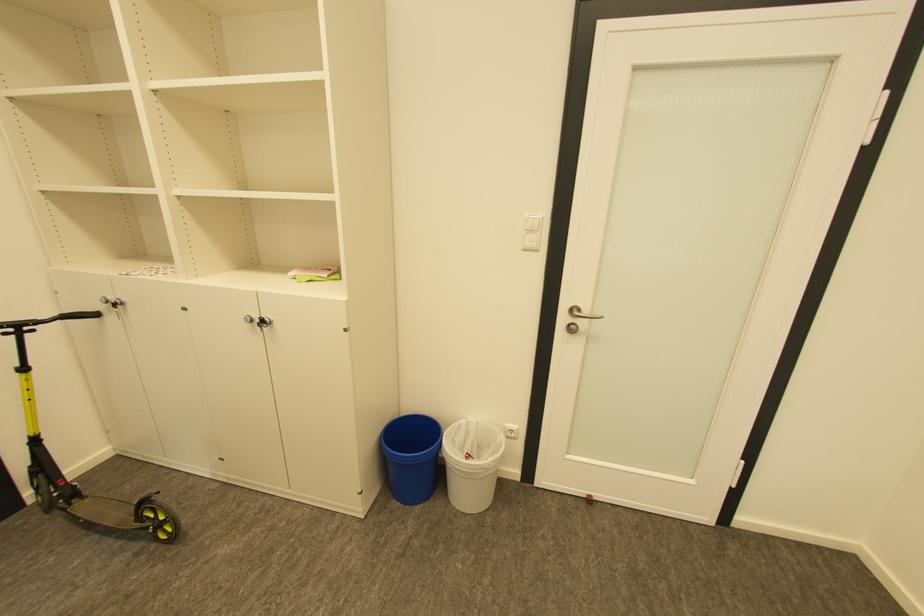
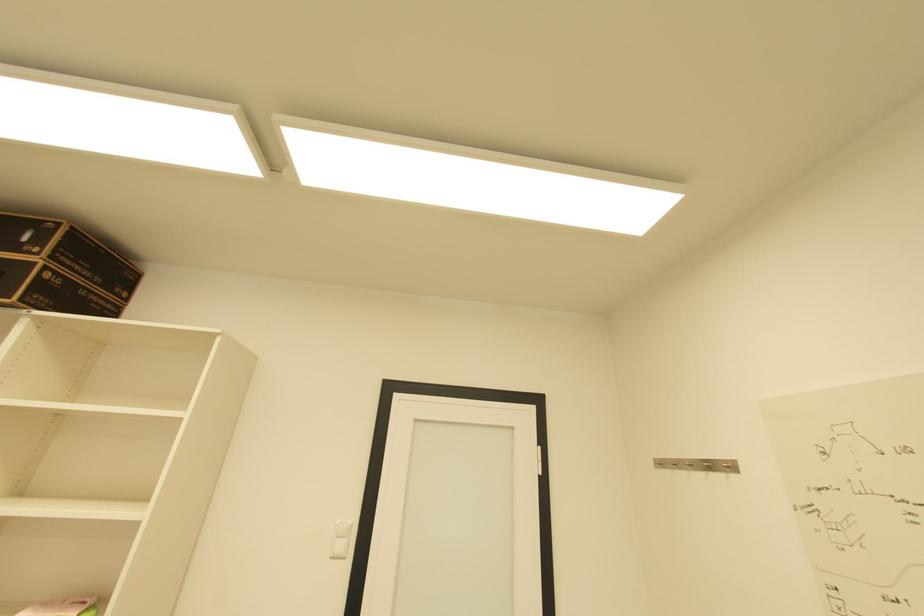
First-person continuous shooting, in which direction is the camera rotating?

The camera rotated toward right-up.